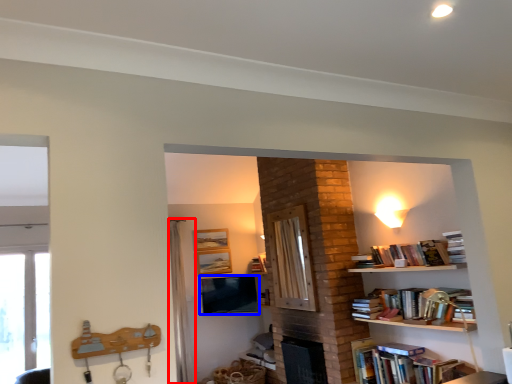
Question: Which point is further to the camera, curtain (highlighted by a red box) or television (highlighted by a blue box)?

Choices:
 (A) curtain
 (B) television

Answer: (B)